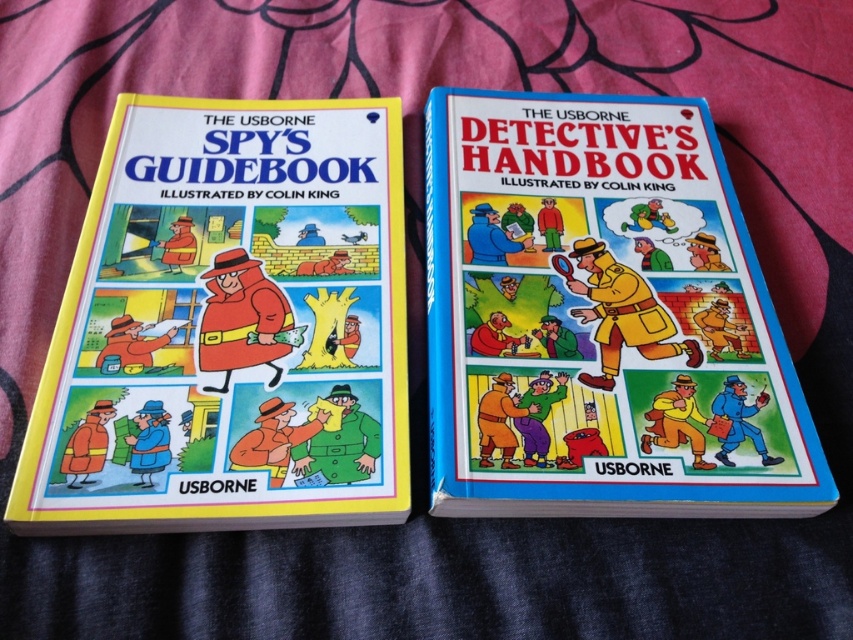
Which of these two, matte yellow book at left or blue hardcover book at center, stands taller?

blue hardcover book at center

Does matte yellow book at left appear over blue hardcover book at center?

No.

Who is more forward, (x=140, y=141) or (x=616, y=157)?

Point (x=140, y=141) is in front.

Where is `matte yellow book at left`? matte yellow book at left is located at coordinates (228, 324).